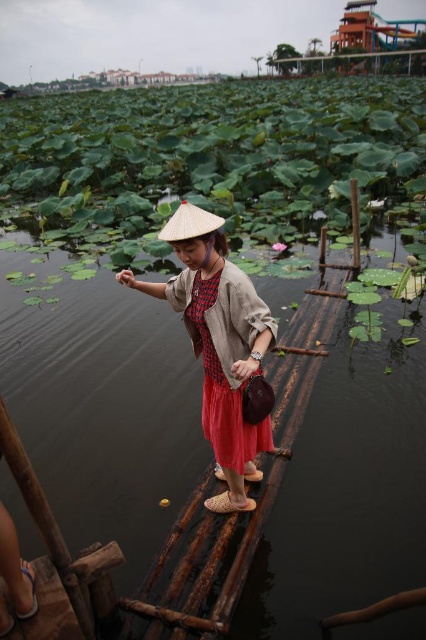
Measure the distance between point [356,499] and camera.

4.23 meters

Does dark brown water at center appear over natural straw hat at center?

No.

Who is more forward, (60, 568) or (213, 225)?

Point (60, 568)

Image resolution: width=426 pixels, height=640 pixels. In order to click on dark brown water at center in this screenshot , I will do `click(154, 461)`.

Is point (256, 316) farther from viewer compared to point (199, 232)?

Yes, point (256, 316) is behind point (199, 232).

Can you confirm if matte brown hat at center is shorter than natural straw hat at center?

No, matte brown hat at center is not shorter than natural straw hat at center.

Between point (218, 500) and point (212, 227), which one is positioned in front?

Point (212, 227) is more forward.

The width and height of the screenshot is (426, 640). What are the coordinates of `matte brown hat at center` in the screenshot? It's located at (218, 342).

Does point (287, 429) come farther from viewer compared to point (265, 433)?

Yes, it is.

Based on the photo, does dark brown water at center have a smaller size compared to matte brown hat at center?

Yes, dark brown water at center is smaller than matte brown hat at center.

Between point (169, 368) and point (256, 429), which one is positioned behind?

The point (169, 368) is more distant.

Where is `dark brown water at center`? This screenshot has height=640, width=426. dark brown water at center is located at coordinates coord(154,461).